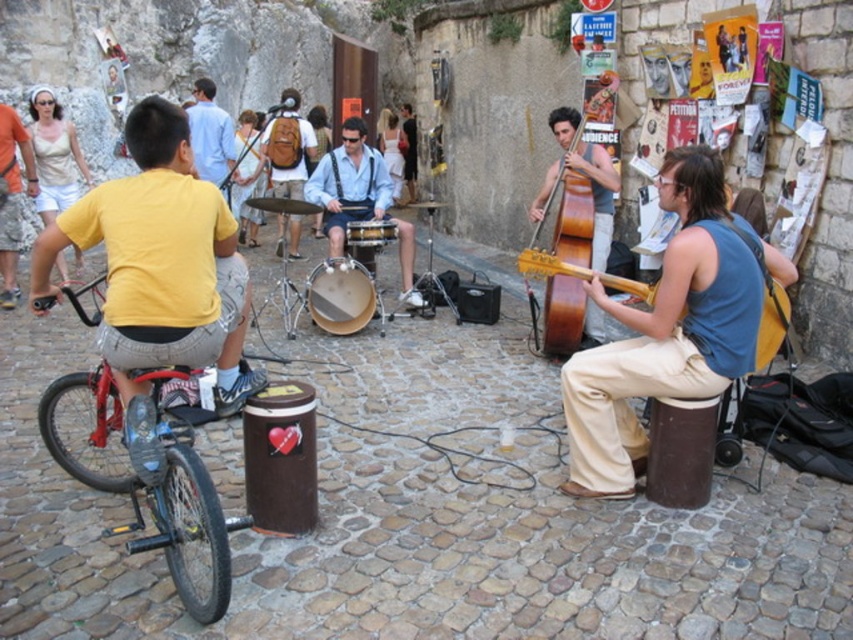
Question: Can you confirm if smooth brown drum at center is thinner than wooden drum at center?

Choices:
 (A) no
 (B) yes

Answer: (A)

Question: Where is red matte bicycle at left located in relation to smooth brown drum at center in the image?

Choices:
 (A) left
 (B) right

Answer: (A)

Question: Does brown wooden cello at center have a greater width compared to wooden drum at center?

Choices:
 (A) yes
 (B) no

Answer: (A)

Question: Which object appears closest to the camera in this image?

Choices:
 (A) blue sleeveless shirt at center
 (B) brown backpack at center

Answer: (A)

Question: Estimate the real-world distances between objects in this image. Which object is closer to the light blue shirt at center?

Choices:
 (A) red matte bicycle at left
 (B) light blue denim shorts at center
 (C) wooden drum at center

Answer: (B)

Question: Which object appears farthest from the camera in this image?

Choices:
 (A) smooth brown drum at center
 (B) light blue shirt at center

Answer: (B)